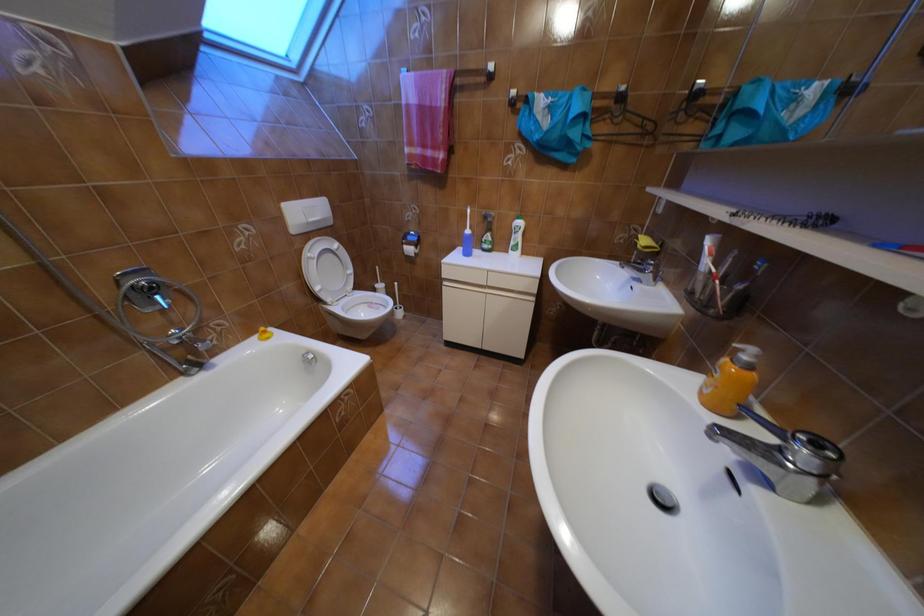
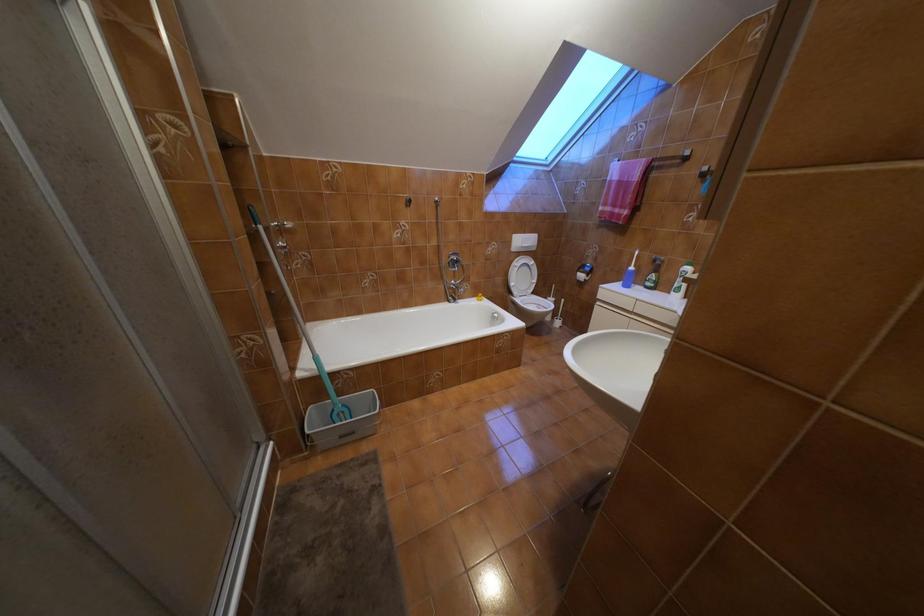
Question: The first image is from the beginning of the video and the second image is from the end. How did the camera likely rotate when shooting the video?

Choices:
 (A) Left
 (B) Right
 (C) Up
 (D) Down

Answer: (A)